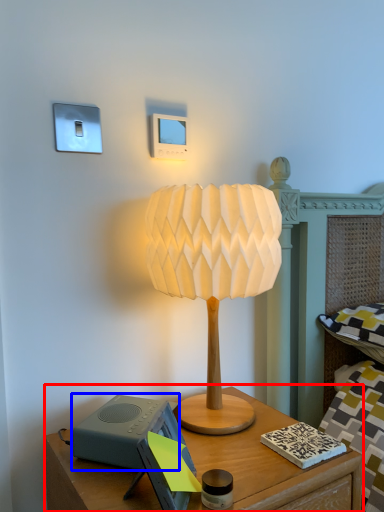
Question: Which object appears closest to the camera in this image, nightstand (highlighted by a red box) or speaker (highlighted by a blue box)?

Choices:
 (A) nightstand
 (B) speaker

Answer: (A)